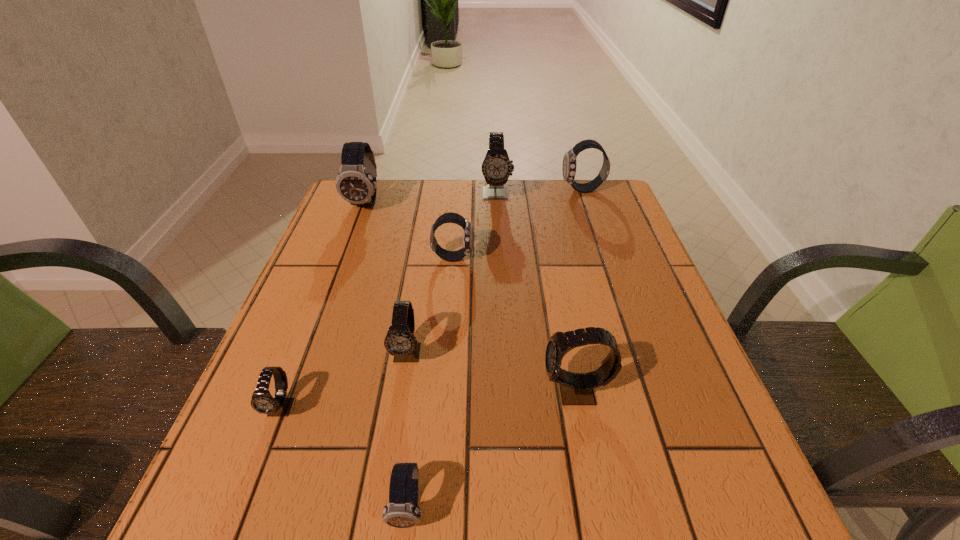
Find the location of a particular element. The image size is (960, 540). the second gray watch from left to right is located at coordinates (400, 342).

This screenshot has width=960, height=540. In order to click on the leftmost gray watch in this screenshot , I will do `click(262, 401)`.

Image resolution: width=960 pixels, height=540 pixels. Find the location of `the smallest dark watch`. the smallest dark watch is located at coordinates (402, 511).

Locate an element on the screen. The height and width of the screenshot is (540, 960). the nearest watch is located at coordinates (402, 511).

Identify the location of vacant area situated on the face of the third object from right to left. The width and height of the screenshot is (960, 540). (498, 235).

Identify the location of free space located 0.050m on the face of the leftmost dark watch. (357, 228).

Find the location of a particular element. The image size is (960, 540). vacant space located 0.110m on the face of the rightmost watch is located at coordinates (525, 190).

Where is `vacant space located on the face of the rightmost watch`? vacant space located on the face of the rightmost watch is located at coordinates pyautogui.click(x=444, y=190).

The width and height of the screenshot is (960, 540). I want to click on vacant space located on the face of the rightmost watch, so click(x=494, y=190).

Locate an element on the screen. The height and width of the screenshot is (540, 960). vacant region located 0.100m on the face of the rightmost gray watch is located at coordinates (486, 392).